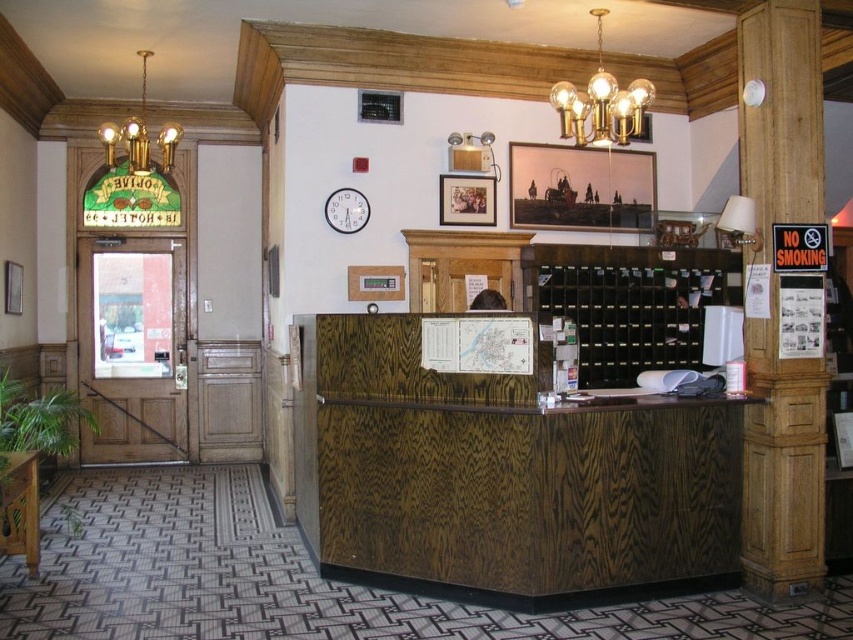
Question: Which point appears closest to the camera in this image?

Choices:
 (A) (456, 152)
 (B) (811, 540)
 (C) (334, 198)
 (D) (579, 122)

Answer: (B)

Question: Is matte gold lampshade at upper center above white wooden clock at upper center?

Choices:
 (A) no
 (B) yes

Answer: (B)

Question: Among these points, which one is nearest to the camera?

Choices:
 (A) (479, 134)
 (B) (605, 83)

Answer: (B)

Question: Is gold metallic chandelier at upper center positioned behind white wooden clock at upper center?

Choices:
 (A) no
 (B) yes

Answer: (A)

Question: Which of the following is the farthest from the observer?

Choices:
 (A) (113, 131)
 (B) (566, 112)
 (C) (357, 212)
 (D) (474, 147)

Answer: (D)

Question: Does wooden pillar at right appear on the left side of gold brass chandelier at upper left?

Choices:
 (A) no
 (B) yes

Answer: (A)